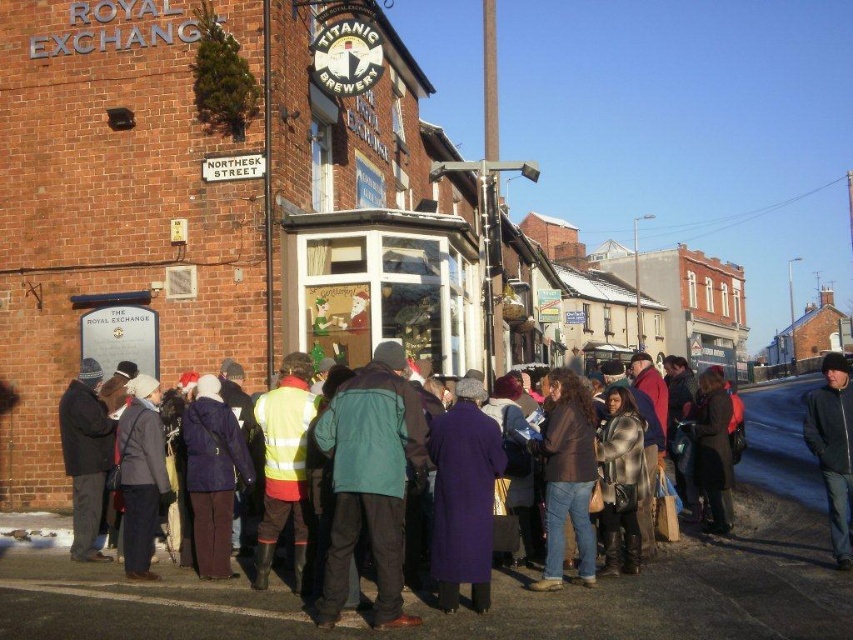
Question: Which object appears farthest from the camera in this image?

Choices:
 (A) purple wool coat at center
 (B) matte black coat at lower left
 (C) matte green jacket at center
 (D) teal fabric jacket at center

Answer: (C)

Question: Is teal fabric jacket at center above dark blue jacket at center?

Choices:
 (A) no
 (B) yes

Answer: (B)

Question: Which point appears closest to the camera in this image?

Choices:
 (A) (164, 588)
 (B) (351, 440)
 (C) (126, 564)
 (D) (834, 545)

Answer: (B)

Question: Is teal fabric jacket at center positioned in front of matte black coat at lower left?

Choices:
 (A) no
 (B) yes

Answer: (B)

Question: Is matte green jacket at center smaller than dark blue jacket at center?

Choices:
 (A) yes
 (B) no

Answer: (A)

Question: Which of the following is the closest to the observer?

Choices:
 (A) dark brown leather jacket at center
 (B) teal fabric jacket at center

Answer: (B)